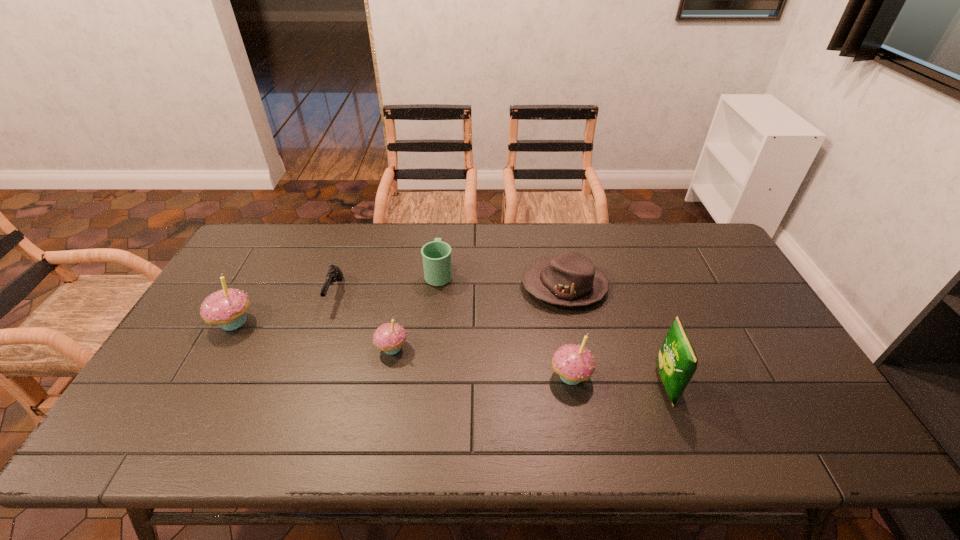
The image size is (960, 540). What are the coordinates of `vacant space that's between the fourth object from left to right and the gun` in the screenshot? It's located at (387, 283).

At what (x,y) coordinates should I click in order to perform the action: click on free spot between the rightmost object and the rightmost cupcake. Please return your answer as a coordinate pair (x, y). This screenshot has height=540, width=960. Looking at the image, I should click on (618, 380).

Locate an element on the screen. free space between the mug and the hat is located at coordinates (501, 279).

Where is `the closest object to the gun`? The width and height of the screenshot is (960, 540). the closest object to the gun is located at coordinates (389, 337).

Find the location of a particular element. This screenshot has width=960, height=540. object that ranks as the third closest to the leftmost cupcake is located at coordinates (436, 255).

Identify the location of cupcake that stands as the closest to the second cupcake from left to right. The image size is (960, 540). (227, 308).

Choose which cupcake is the nearest neighbor to the rightmost object. Please provide its 2D coordinates. Your answer should be formatted as a tuple, i.e. [(x, y)], where the tuple contains the x and y coordinates of a point satisfying the conditions above.

[(573, 363)]

This screenshot has height=540, width=960. What are the coordinates of `free spot that satisfies the following two spatial constraints: 1. on the decorative side of the hat; 2. on the front side of the second cupcake from right to left` in the screenshot? It's located at (577, 348).